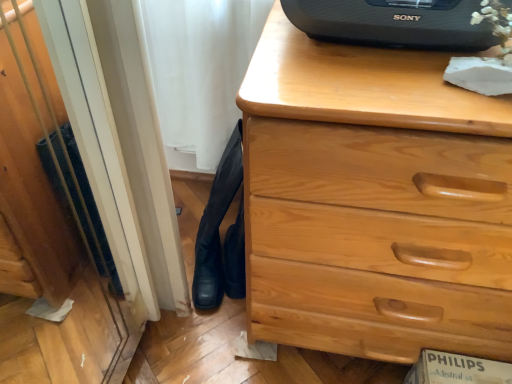
Question: Would you say black leather boots at lower left is to the left or to the right of black plastic speaker at upper center in the picture?

Choices:
 (A) left
 (B) right

Answer: (A)

Question: Is black leather boots at lower left inside the boundaries of black plastic speaker at upper center, or outside?

Choices:
 (A) outside
 (B) inside

Answer: (A)

Question: Which object is positioned farthest from the light wood chest of drawers at center?

Choices:
 (A) black leather boots at lower left
 (B) black plastic speaker at upper center

Answer: (A)

Question: Estimate the real-world distances between objects in this image. Which object is farther from the black plastic speaker at upper center?

Choices:
 (A) black leather boots at lower left
 (B) light wood chest of drawers at center

Answer: (A)